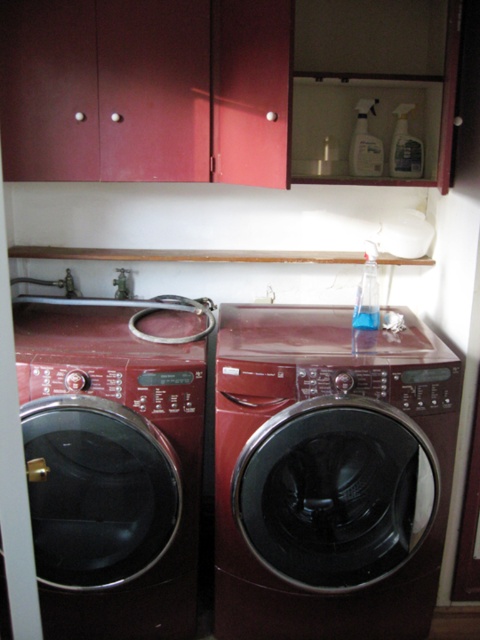
Question: Which object is the closest to the transparent plastic bottle at upper right?

Choices:
 (A) clear plastic spray bottle at upper center
 (B) clear plastic spray bottle at upper right

Answer: (A)

Question: Estimate the real-world distances between objects in this image. Which object is farther from the matte black washing machine at left?

Choices:
 (A) clear plastic spray bottle at upper right
 (B) transparent plastic bottle at upper right
 (C) shiny dark red washing machine at center
 (D) clear plastic spray bottle at upper center

Answer: (A)

Question: Is matte black washing machine at left further to the viewer compared to clear plastic spray bottle at upper right?

Choices:
 (A) no
 (B) yes

Answer: (A)

Question: Can you confirm if clear plastic spray bottle at upper center is positioned to the right of transparent plastic bottle at upper right?

Choices:
 (A) yes
 (B) no

Answer: (A)

Question: Which object is positioned closest to the shiny dark red washing machine at center?

Choices:
 (A) clear plastic spray bottle at upper right
 (B) matte black washing machine at left

Answer: (B)

Question: Is matte black washing machine at left behind transparent plastic bottle at upper right?

Choices:
 (A) no
 (B) yes

Answer: (A)